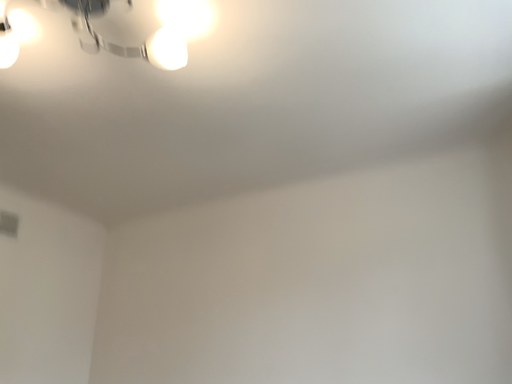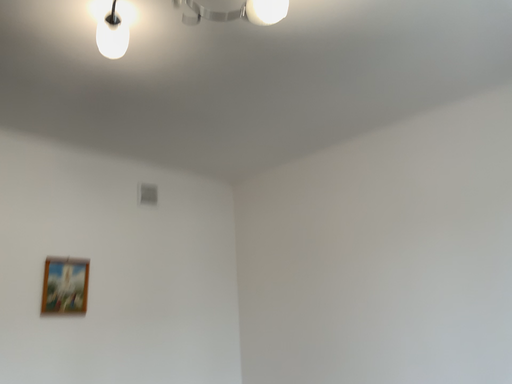
Question: Which way did the camera rotate in the video?

Choices:
 (A) rotated right
 (B) rotated left

Answer: (B)